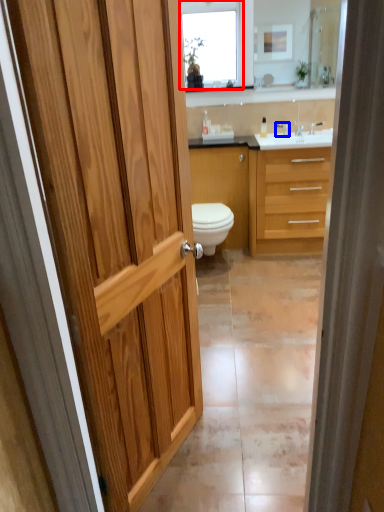
Question: Which object appears farthest to the camera in this image, window (highlighted by a red box) or tap (highlighted by a blue box)?

Choices:
 (A) window
 (B) tap

Answer: (B)